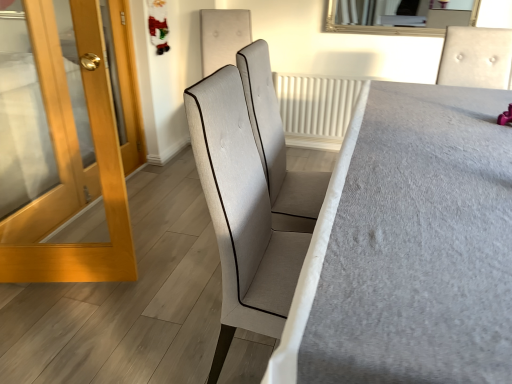
Locate an element on the screen. The width and height of the screenshot is (512, 384). vacant region under wooden glossy door at left (from a real-world perspective) is located at coordinates (65, 286).